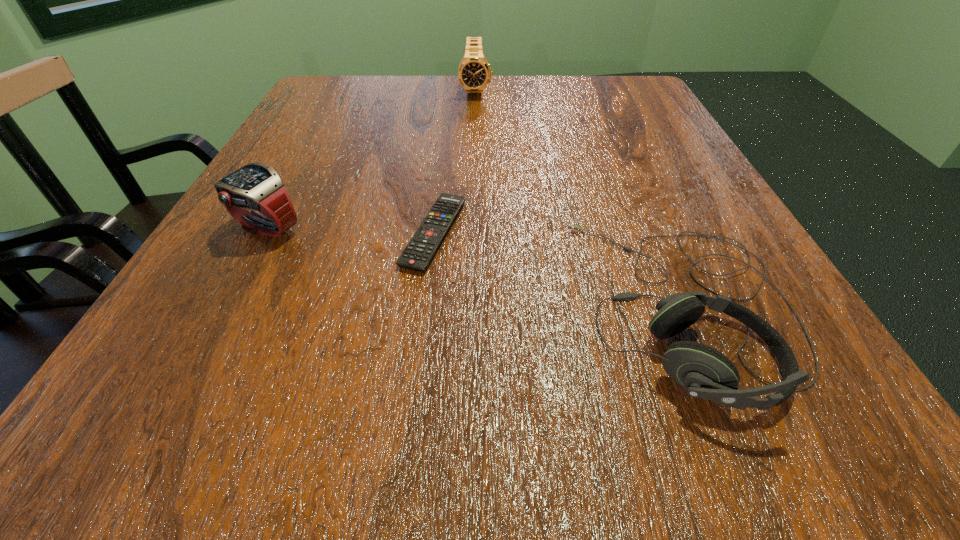
You are a GUI agent. You are given a task and a screenshot of the screen. Output one action in this format:
    pyautogui.click(x=<x>, y=<y>)
    Task: Click on the vacant point located between the nearer watch and the remote control
    The height and width of the screenshot is (540, 960).
    Given the screenshot: What is the action you would take?
    pyautogui.click(x=350, y=231)

Where is `empty space that is in between the tallest object and the remote control`? empty space that is in between the tallest object and the remote control is located at coordinates (455, 162).

Locate an element on the screen. This screenshot has width=960, height=540. free space between the farther watch and the leftmost object is located at coordinates (372, 160).

Identify the location of free space between the remote control and the headset. point(560,269).

Where is `the second closest object to the remote control`? Image resolution: width=960 pixels, height=540 pixels. the second closest object to the remote control is located at coordinates (256, 187).

Identify which object is the closest to the shortest object. Please provide its 2D coordinates. Your answer should be formatted as a tuple, i.e. [(x, y)], where the tuple contains the x and y coordinates of a point satisfying the conditions above.

[(704, 372)]